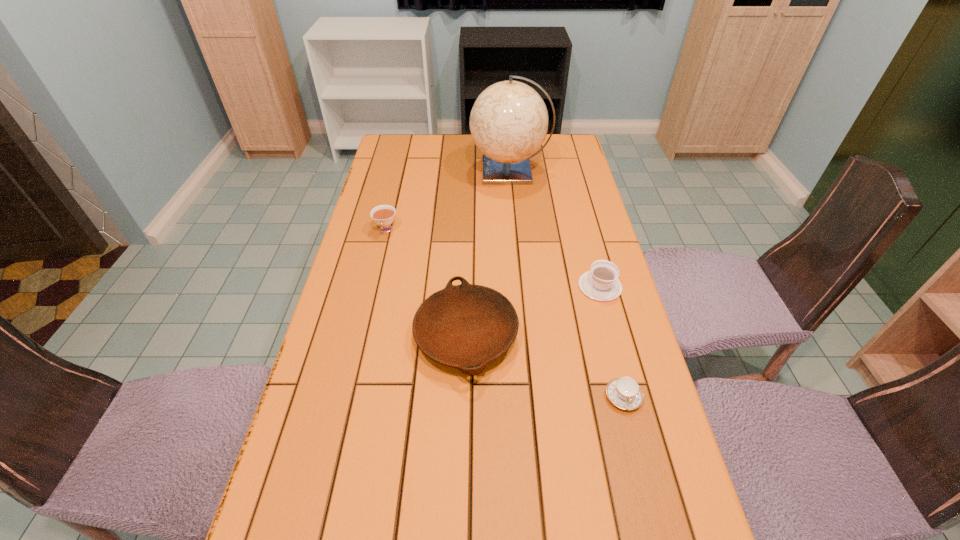
Find the location of `object that is at the far right corner`. object that is at the far right corner is located at coordinates (509, 120).

Identify the location of vacant space at the left edge. Image resolution: width=960 pixels, height=540 pixels. 403,198.

Locate an element on the screen. The image size is (960, 540). vacant space at the right edge of the desktop is located at coordinates (577, 165).

This screenshot has height=540, width=960. In the image, there is a desktop. In order to click on vacant area at the far right corner in this screenshot , I will do `click(556, 158)`.

Locate an element on the screen. empty space between the second farthest teacup and the plate is located at coordinates (533, 310).

Identify the location of vacant area that lies between the leftmost object and the second farthest teacup. The image size is (960, 540). (493, 258).

This screenshot has width=960, height=540. What are the coordinates of `free space between the plate and the leftmost teacup` in the screenshot? It's located at (426, 282).

The image size is (960, 540). I want to click on vacant space that's between the globe and the nearest teacup, so click(566, 284).

In order to click on vacant point located between the second farthest teacup and the shortest teacup in this screenshot , I will do `click(612, 341)`.

This screenshot has height=540, width=960. I want to click on free space between the shortest object and the second nearest teacup, so click(x=612, y=341).